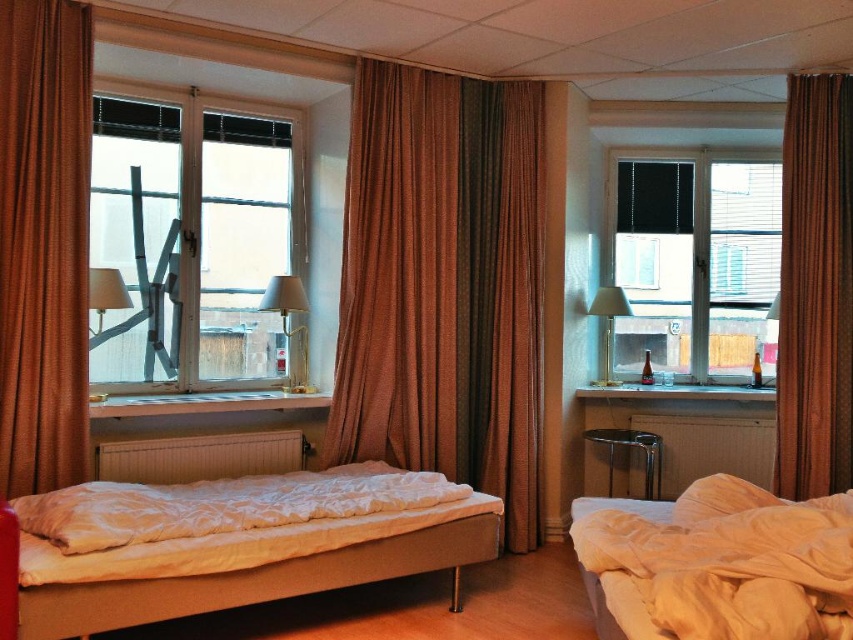
You are organizing a small event in the room and need to place a decorative item that requires a flat surface. Considering the white soft pillow at lower right and the metallic gold table lamp at right, which object would be more suitable for placing the item?

The white soft pillow at lower right has a larger size compared to the metallic gold table lamp at right, making it more suitable for placing the decorative item due to its greater surface area.

You are trying to find a place to put your phone in the room. You see a white soft pillow at lower right and a metallic gold table lamp at right. Which object is closer to the floor?

The white soft pillow at lower right is closer to the floor since it is positioned under the metallic gold table lamp at right.

You are a delivery person who needs to place a 2.5 meter long package between the brown textured curtain at left and the white soft pillow at lower right. Can you fit the package horizontally between them?

The distance between the brown textured curtain at left and the white soft pillow at lower right is 2.61 meters. Since the package is 2.5 meters long, it can fit horizontally between them as the space is slightly larger than the package.